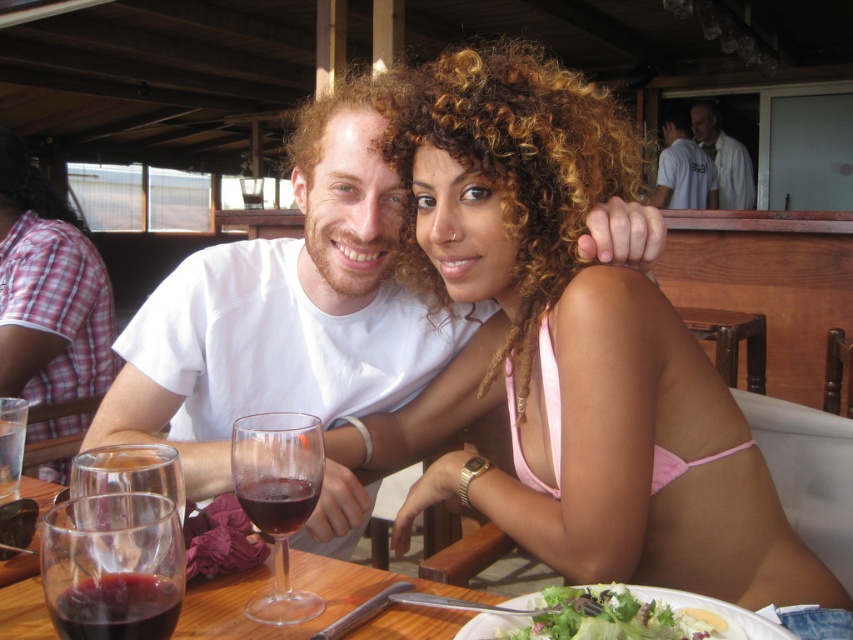
You are a photographer at the beach and want to capture a closeup of the pink fabric bikini at center. According to the coordinates provided, where should you aim your camera?

The pink fabric bikini at center is located at point (567,353), so you should aim your camera there.

You are a lifeguard at a poolside bar and need to serve drinks to guests. A customer wearing a pink fabric bikini at center has requested a drink. The transparent glass at table left is empty. Can you reach the glass without moving past the 24 inches safety zone around the pool edge?

The distance between the pink fabric bikini at center and the transparent glass at table left is 20.89 inches, which is within the 24 inches safety zone. Therefore, you can safely reach the transparent glass at table left without crossing the safety boundary.

You are standing at the center of the image and want to locate the pink fabric shirt at left. Which direction should you look to find it?

The pink fabric shirt at left is located at point 0.456 on the horizontal axis and 0.057 on the vertical axis. Since you are at the center, you should look to the left and slightly downward to find it.